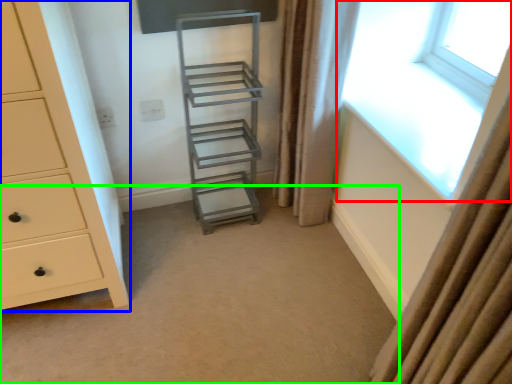
Question: Which is nearer to the window (highlighted by a red box)? chest of drawers (highlighted by a blue box) or plain (highlighted by a green box).

Choices:
 (A) chest of drawers
 (B) plain

Answer: (B)